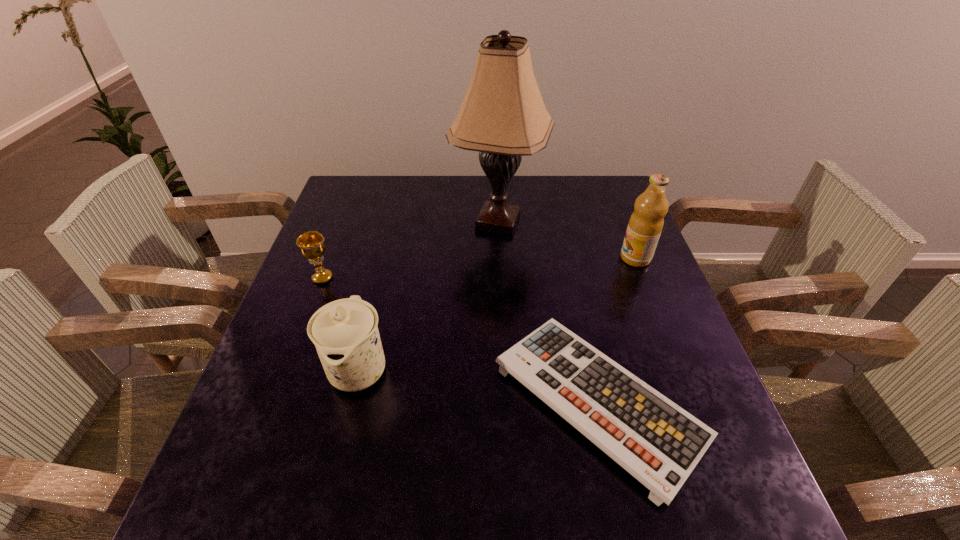
I want to click on vacant space that's between the shortest object and the third nearest object, so click(461, 339).

Find the location of a particular element. vacant region between the tallest object and the olive oil is located at coordinates (566, 240).

You are a GUI agent. You are given a task and a screenshot of the screen. Output one action in this format:
    pyautogui.click(x=<x>, y=<y>)
    Task: Click on the free space that is in between the olive oil and the third nearest object
    This screenshot has height=540, width=960.
    Given the screenshot: What is the action you would take?
    pyautogui.click(x=479, y=268)

Image resolution: width=960 pixels, height=540 pixels. I want to click on free space between the third nearest object and the computer keyboard, so click(461, 339).

Where is `vacant area that lies between the fourth shortest object and the computer keyboard`? The width and height of the screenshot is (960, 540). vacant area that lies between the fourth shortest object and the computer keyboard is located at coordinates (617, 329).

Locate an element on the screen. This screenshot has width=960, height=540. free spot between the lamp and the shortest object is located at coordinates (548, 311).

The width and height of the screenshot is (960, 540). Find the location of `object that is the fourth closest to the lamp`. object that is the fourth closest to the lamp is located at coordinates (345, 333).

This screenshot has width=960, height=540. In order to click on object that is the third closest to the chalice in this screenshot , I will do `click(659, 443)`.